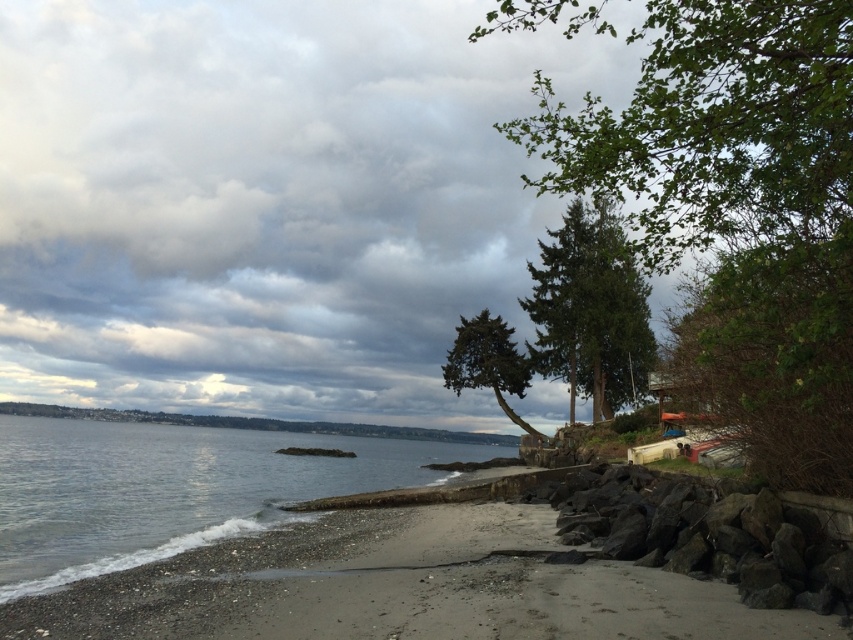
You are standing at the point closest to the camera in the image. Which of the two points, point (700,225) or point (753,561), is closer to you?

Point (700,225) is in front of point (753,561), so it is closer to you.

You are standing on the beach and want to take a photo of both the clear water at lower left and the green textured tree at center. Which object should you focus on first if you want to capture both in one frame without moving the camera?

The clear water at lower left is shorter than the green textured tree at center, so you should focus on the green textured tree at center first to ensure both are in focus.

Based on the photo, you are standing on the beach and want to take a photo of the green leafy tree at center. Your camera has a maximum focus range of 5 meters. Can you capture the tree clearly?

The green leafy tree at center is 4.70 meters from viewer, so yes, the camera can focus on it clearly since it is within the 5 meter range.